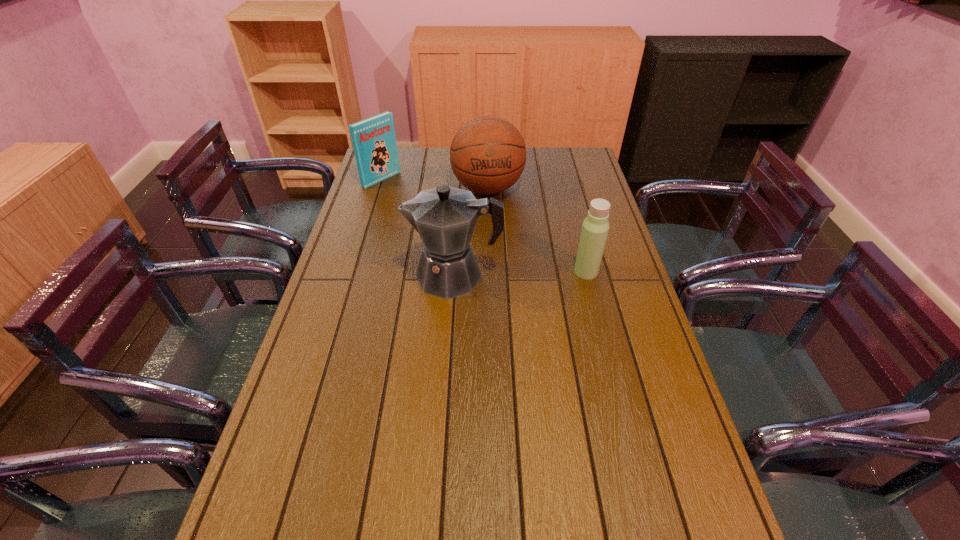
Find the location of a particular element. vacant space located on the side with brand label of the basketball is located at coordinates (494, 226).

In order to click on free space located 0.400m on the front cover of the leftmost object in this screenshot , I will do `click(463, 231)`.

At what (x,y) coordinates should I click in order to perform the action: click on vacant area situated on the front cover of the leftmost object. Please return your answer as a coordinate pair (x, y). The height and width of the screenshot is (540, 960). Looking at the image, I should click on (419, 203).

I want to click on free space located on the front cover of the leftmost object, so click(408, 197).

This screenshot has width=960, height=540. In order to click on basketball at the far edge in this screenshot , I will do `click(487, 155)`.

You are a GUI agent. You are given a task and a screenshot of the screen. Output one action in this format:
    pyautogui.click(x=<x>, y=<y>)
    Task: Click on the book that is at the far edge
    
    Given the screenshot: What is the action you would take?
    (374, 142)

The width and height of the screenshot is (960, 540). I want to click on object that is positioned at the left edge, so click(x=374, y=142).

You are a GUI agent. You are given a task and a screenshot of the screen. Output one action in this format:
    pyautogui.click(x=<x>, y=<y>)
    Task: Click on the object that is at the right edge
    The width and height of the screenshot is (960, 540).
    Given the screenshot: What is the action you would take?
    595,227

Find the location of a particular element. The width and height of the screenshot is (960, 540). object that is at the far left corner is located at coordinates (374, 142).

Image resolution: width=960 pixels, height=540 pixels. Identify the location of free space at the far edge of the desktop. (420, 160).